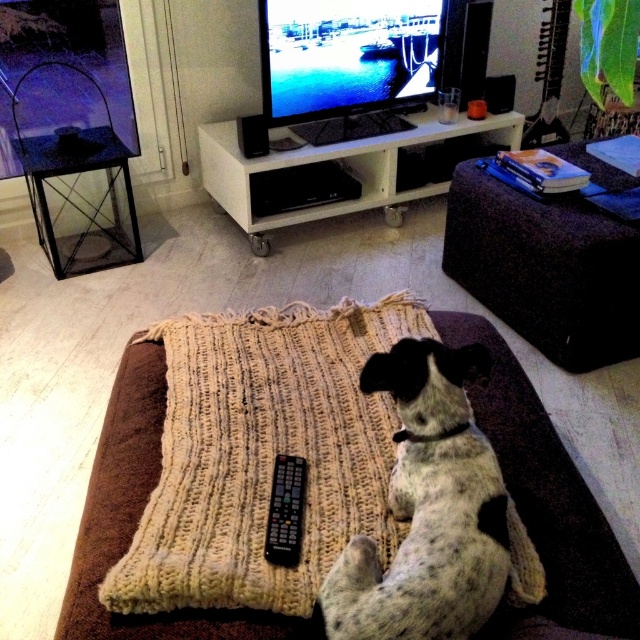
Question: Is beige knitted blanket at center positioned at the back of spotted fur dog at center?

Choices:
 (A) yes
 (B) no

Answer: (A)

Question: Which point is farther from the camera taking this photo?

Choices:
 (A) (70, 584)
 (B) (531, 262)
 (C) (280, 461)

Answer: (B)

Question: Observing the image, what is the correct spatial positioning of spotted fur dog at center in reference to white glossy entertainment center at center?

Choices:
 (A) below
 (B) above

Answer: (A)

Question: Among these objects, which one is nearest to the camera?

Choices:
 (A) purple fabric at upper right
 (B) black plastic remote at center

Answer: (B)

Question: Which point appears farthest from the camera in this image?

Choices:
 (A) (296, 534)
 (B) (406, 420)
 (C) (99, 634)
 (D) (531, 230)

Answer: (D)

Question: Where is spotted fur dog at center located in relation to white glossy entertainment center at center in the image?

Choices:
 (A) right
 (B) left

Answer: (B)